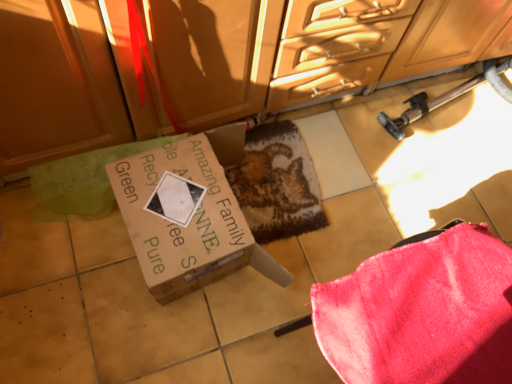
The width and height of the screenshot is (512, 384). I want to click on vacant space situated on the left part of brown cardboard box at center, so click(67, 259).